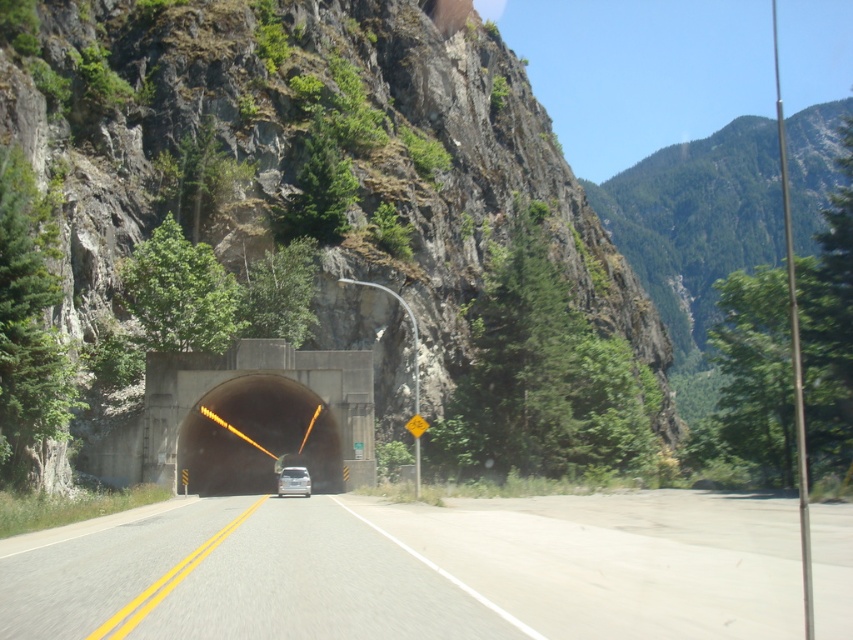
In the scene shown: You are a hiker who just entered the tunnel through the asphalt road at center. After walking 10 meters straight, will you still be inside the tunnel?

Yes, because the tunnel entrance is framed by a concrete structure with bright orange lights, indicating it is long enough for you to walk 10 meters inside before possibly exiting.

You are a hiker planning to take a photo of the rocky gray mountain at center and the black concrete tunnel at center. Which object should you focus on first if you want both to be in the same frame without moving your camera?

You should focus on the black concrete tunnel at center first because it is closer to you than the rocky gray mountain at center, which is further away.